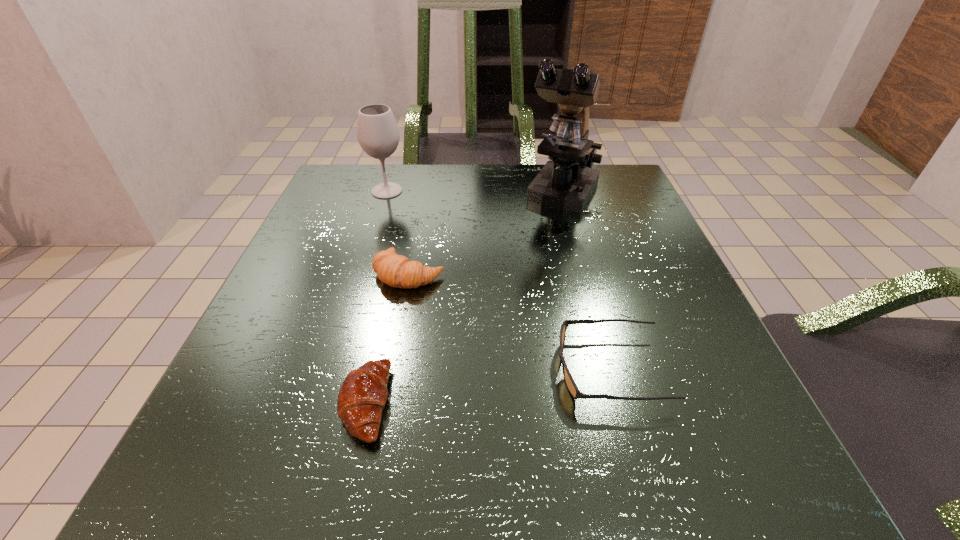
Locate an element on the screen. vacant space located on the front-facing side of the sunglasses is located at coordinates (350, 369).

What are the coordinates of `blank space located 0.120m on the front-facing side of the sunglasses` in the screenshot? It's located at (474, 369).

This screenshot has width=960, height=540. Identify the location of microscope that is at the far edge. (566, 182).

Locate an element on the screen. This screenshot has width=960, height=540. wineglass positioned at the far edge is located at coordinates (378, 135).

Find the location of `object positioned at the near edge`. object positioned at the near edge is located at coordinates (362, 396).

Image resolution: width=960 pixels, height=540 pixels. I want to click on object at the left edge, so click(x=378, y=135).

This screenshot has width=960, height=540. Identify the location of microscope that is at the right edge. (566, 182).

This screenshot has height=540, width=960. I want to click on sunglasses present at the right edge, so pyautogui.click(x=570, y=383).

Identify the location of object present at the far left corner. (378, 135).

I want to click on object at the far right corner, so pos(566,182).